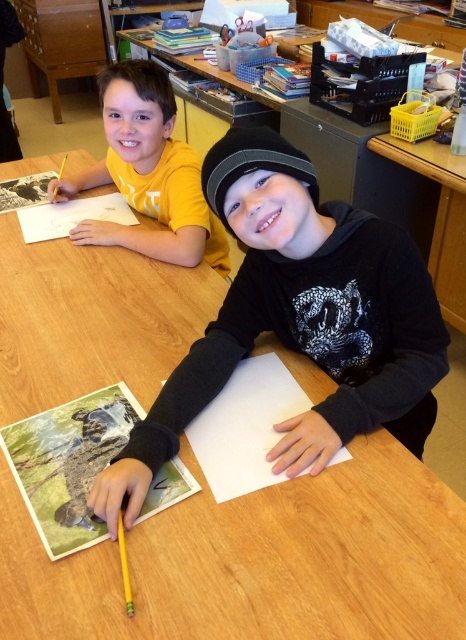
You are standing in the classroom and want to place a sticker on the exact location of the point labeled as point (148,173). Where should you place it?

The point labeled as point (148,173) is on the matte yellow shirt at upper left, so you should place the sticker on the matte yellow shirt at upper left at its upper left area.

You are a photographer taking a picture of the matte yellow shirt at upper left and the white paper at center. Which object will appear smaller in your photo?

The white paper at center will appear smaller in the photo because it is positioned behind the matte yellow shirt at upper left, making it farther away from the camera and thus appear smaller due to perspective.